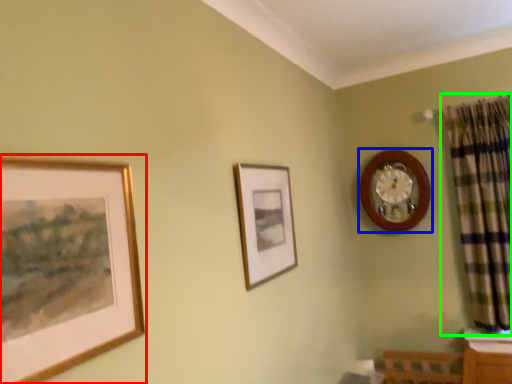
Question: Based on their relative distances, which object is nearer to picture frame (highlighted by a red box)? Choose from wall clock (highlighted by a blue box) and curtain (highlighted by a green box).

Choices:
 (A) wall clock
 (B) curtain

Answer: (A)